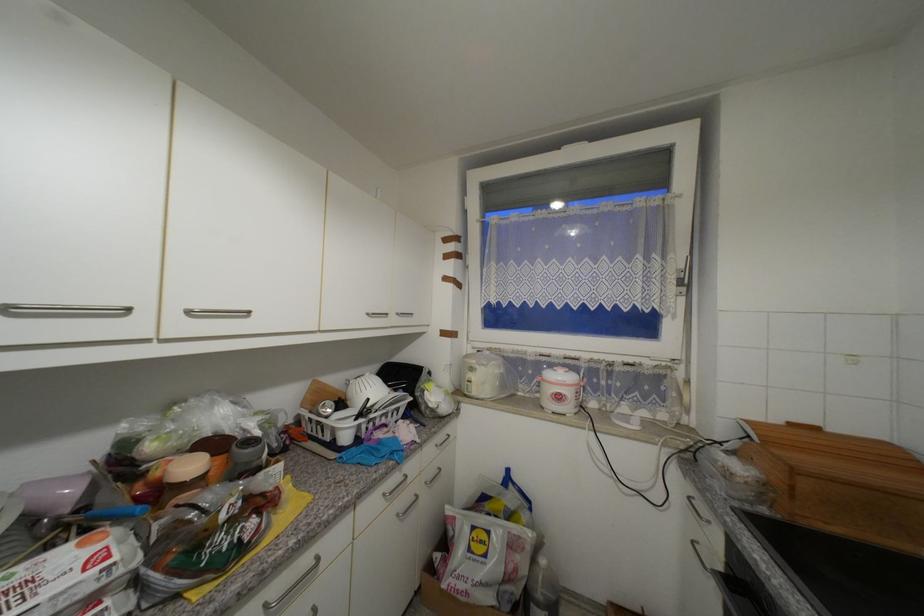
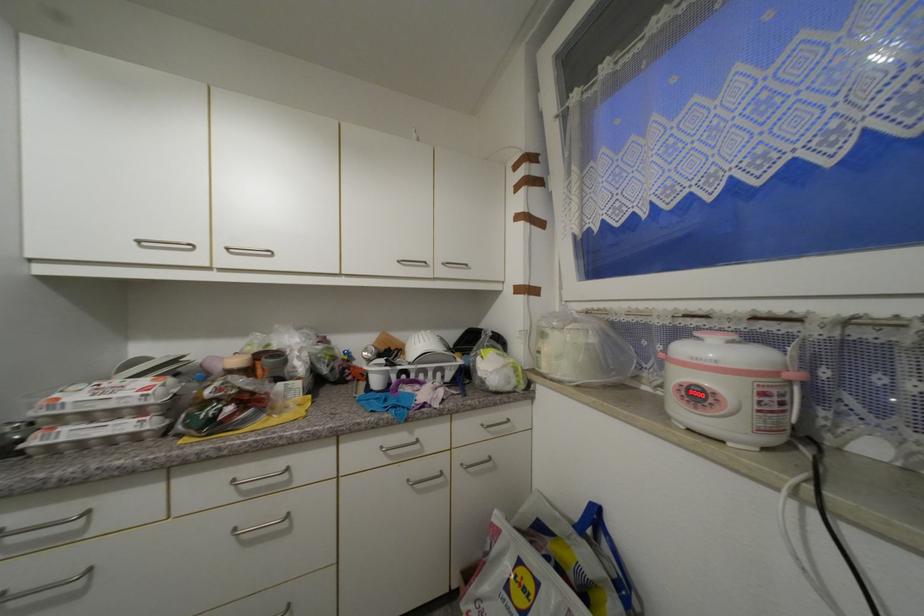
The point at (351, 439) is marked in the first image. Where is the corresponding point in the second image?

(382, 384)